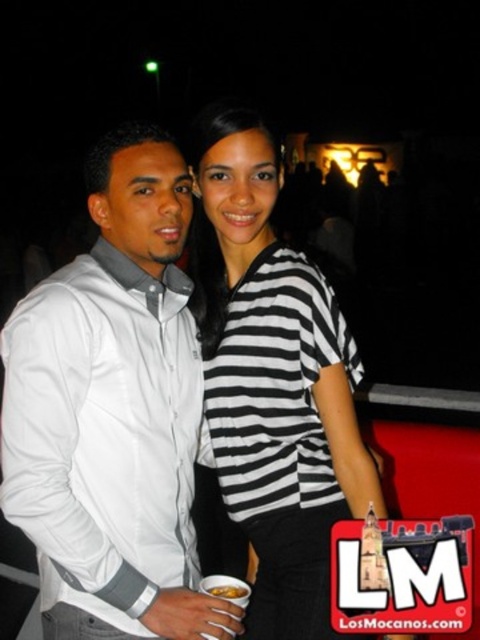
In the scene shown: Does white matte shirt at center have a smaller size compared to black and white striped shirt at center?

No.

This screenshot has height=640, width=480. I want to click on white matte shirt at center, so click(112, 410).